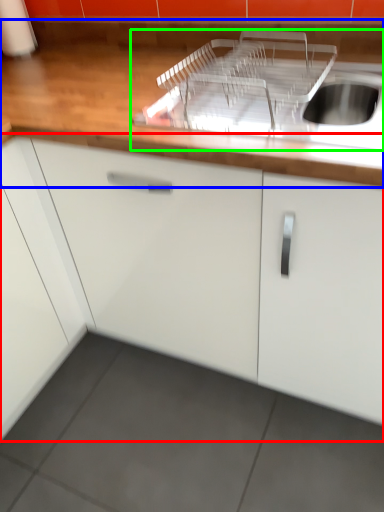
Question: Considering the real-world distances, which object is closest to cabinetry (highlighted by a red box)? countertop (highlighted by a blue box) or sink (highlighted by a green box).

Choices:
 (A) countertop
 (B) sink

Answer: (A)